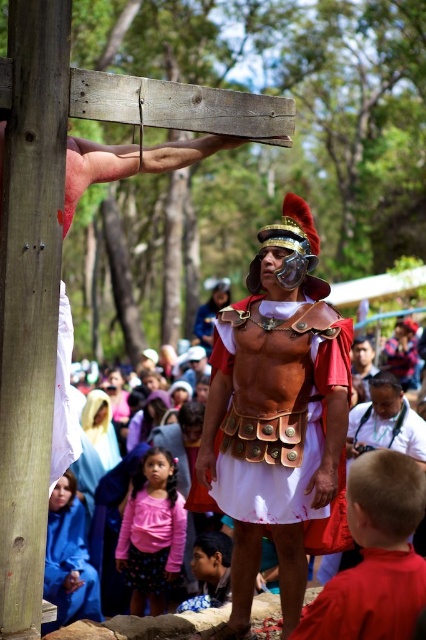
Which is below, matte gold armor at center or blue cotton robe at lower left?

blue cotton robe at lower left

Image resolution: width=426 pixels, height=640 pixels. What are the coordinates of `matte gold armor at center` in the screenshot? It's located at (279, 417).

Looking at this image, can you confirm if red fabric shirt at lower right is thinner than matte white robe at center?

Yes, red fabric shirt at lower right is thinner than matte white robe at center.

Does red fabric shirt at lower right have a greater height compared to matte white robe at center?

In fact, red fabric shirt at lower right may be shorter than matte white robe at center.

Find the location of a particular element. The width and height of the screenshot is (426, 640). red fabric shirt at lower right is located at coordinates (374, 556).

Does point (393, 403) come behind point (69, 618)?

No, (393, 403) is in front of (69, 618).

Who is positioned more to the right, matte white robe at center or blue cotton robe at lower left?

Positioned to the right is matte white robe at center.

Is point (416, 586) positioned in front of point (88, 618)?

Yes, it is in front of point (88, 618).

Image resolution: width=426 pixels, height=640 pixels. Find the location of `matte white robe at center`. matte white robe at center is located at coordinates (368, 592).